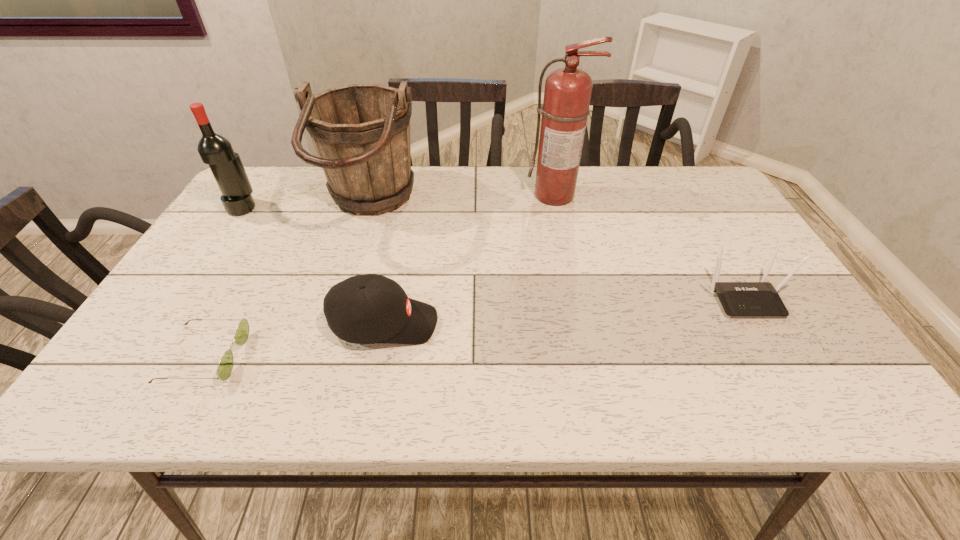
This screenshot has width=960, height=540. Identify the location of unoccupied area between the wine bottle and the bucket. (306, 207).

Locate an element on the screen. The image size is (960, 540). vacant space that's between the shortest object and the baseball cap is located at coordinates (295, 340).

You are a GUI agent. You are given a task and a screenshot of the screen. Output one action in this format:
    pyautogui.click(x=<x>, y=<y>)
    Task: Click on the free space between the leftmost object and the baseball cap
    
    Given the screenshot: What is the action you would take?
    pyautogui.click(x=313, y=265)

You are a GUI agent. You are given a task and a screenshot of the screen. Output one action in this format:
    pyautogui.click(x=<x>, y=<y>)
    Task: Click on the free area in between the second object from right to left and the rightmost object
    This screenshot has width=960, height=540.
    Given the screenshot: What is the action you would take?
    pyautogui.click(x=649, y=246)

Where is `free space between the router and the shortest object`? free space between the router and the shortest object is located at coordinates (474, 327).

This screenshot has width=960, height=540. Find the location of `free space between the tallest object and the baseball cap`. free space between the tallest object and the baseball cap is located at coordinates (469, 259).

Locate an element on the screen. This screenshot has width=960, height=540. object that is the third nearest to the baseball cap is located at coordinates (567, 94).

Identify which object is located as the fifth nearest to the baseball cap. Please provide its 2D coordinates. Your answer should be formatted as a tuple, i.e. [(x, y)], where the tuple contains the x and y coordinates of a point satisfying the conditions above.

[(739, 299)]

Locate an element on the screen. This screenshot has height=540, width=960. free location that satisfies the following two spatial constraints: 1. on the front-facing side of the tallest object; 2. with a logo on the front of the baseball cap is located at coordinates (583, 323).

The height and width of the screenshot is (540, 960). What are the coordinates of `blank area in the image that satisfies the following two spatial constraints: 1. on the front-facing side of the rightmost object; 2. on the front-facing side of the shortest object` in the screenshot? It's located at (779, 357).